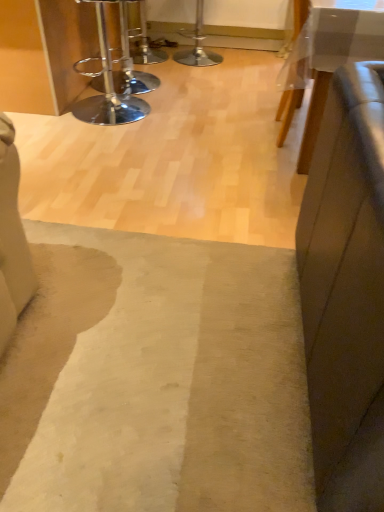
Question: Considering the positions of metallic silver bar stool at upper center and beige woolen mat at center in the image, is metallic silver bar stool at upper center wider or thinner than beige woolen mat at center?

Choices:
 (A) thin
 (B) wide

Answer: (A)

Question: Based on their sizes in the image, would you say metallic silver bar stool at upper center is bigger or smaller than beige woolen mat at center?

Choices:
 (A) small
 (B) big

Answer: (B)

Question: Estimate the real-world distances between objects in this image. Which object is closer to the metallic silver bar stool at upper center?

Choices:
 (A) chrome/metallic bar stool at upper left
 (B) white glossy table at upper right
 (C) beige woolen mat at center

Answer: (A)

Question: Based on their relative distances, which object is nearer to the beige woolen mat at center?

Choices:
 (A) chrome/metallic bar stool at upper left
 (B) white glossy table at upper right
 (C) metallic silver bar stool at upper center

Answer: (B)